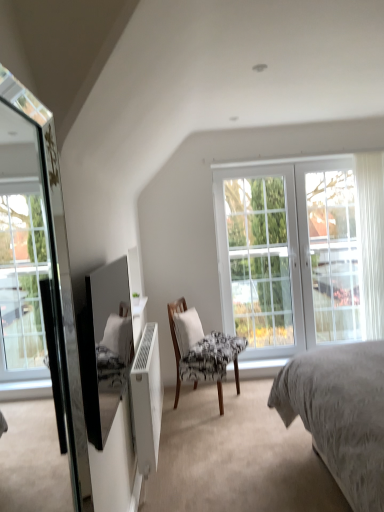
Find the location of a particular element. empty space that is in between wooden chair with patterned fabric at center and white matte radiator at lower left is located at coordinates (182, 437).